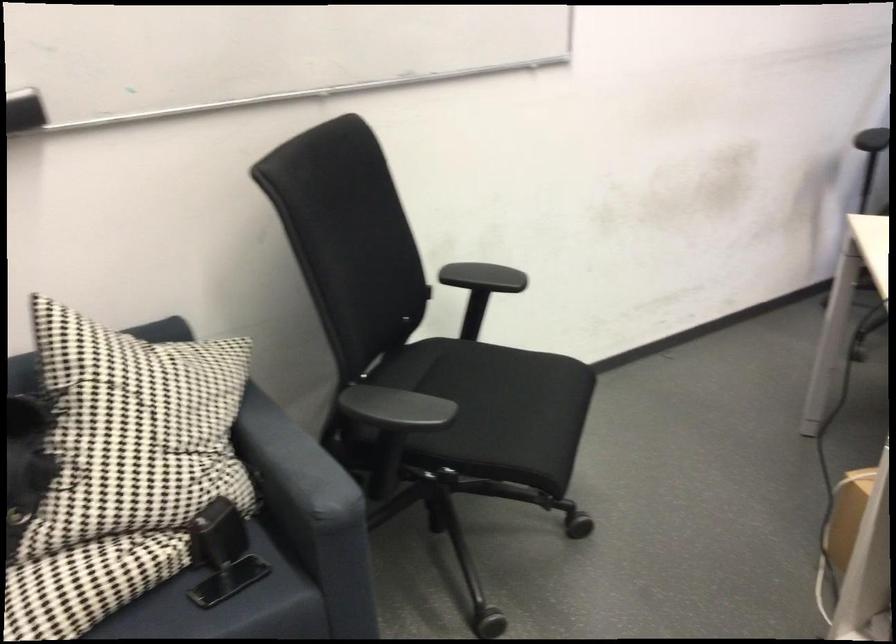
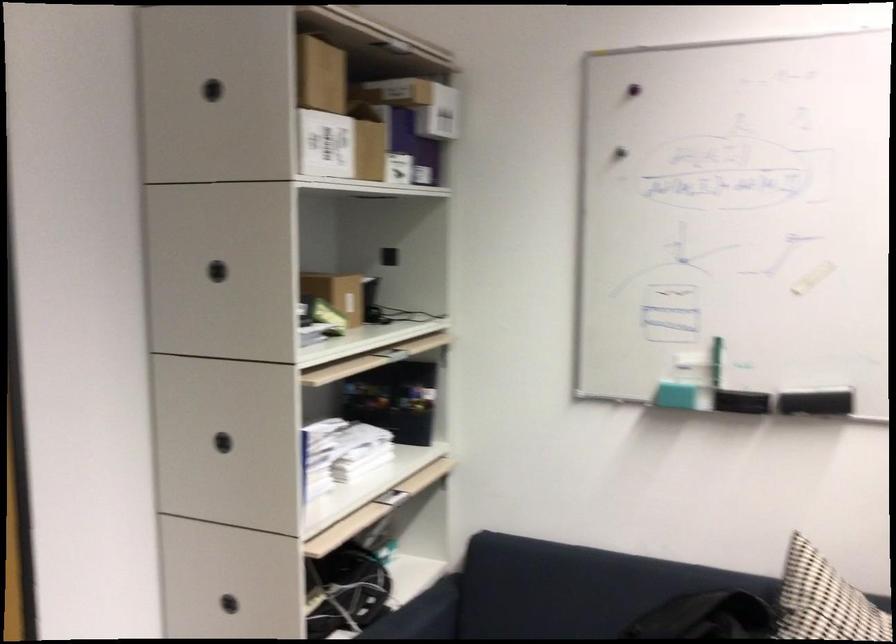
Question: The camera is either moving clockwise (left) or counter-clockwise (right) around the object. The first image is from the beginning of the video and the second image is from the end. Is the camera moving left or right when shooting the video?

Choices:
 (A) Left
 (B) Right

Answer: (B)